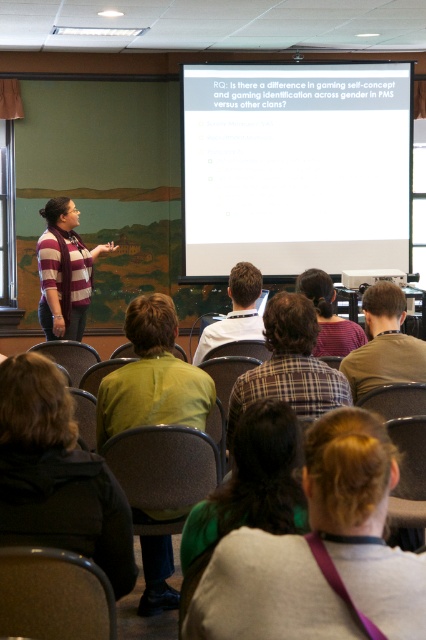
Question: Does plaid fabric shirt at center have a larger size compared to striped sweater at left?

Choices:
 (A) no
 (B) yes

Answer: (A)

Question: Can you confirm if dark brown hair at lower left is positioned below brown plaid shirt at center?

Choices:
 (A) no
 (B) yes

Answer: (B)

Question: Considering the relative positions of dark brown hair at lower left and plaid shirt at center in the image provided, where is dark brown hair at lower left located with respect to plaid shirt at center?

Choices:
 (A) above
 (B) below

Answer: (B)

Question: Which is nearer to the light brown hair at center?

Choices:
 (A) green fabric shirt at center
 (B) plaid shirt at center

Answer: (B)

Question: Estimate the real-world distances between objects in this image. Which object is farther from the matte black projector at center?

Choices:
 (A) white matte projection screen at upper center
 (B) green fabric hair at center
 (C) striped sweater at left

Answer: (B)

Question: Among these objects, which one is nearest to the camera?

Choices:
 (A) plaid fabric shirt at center
 (B) white matte projection screen at upper center

Answer: (A)